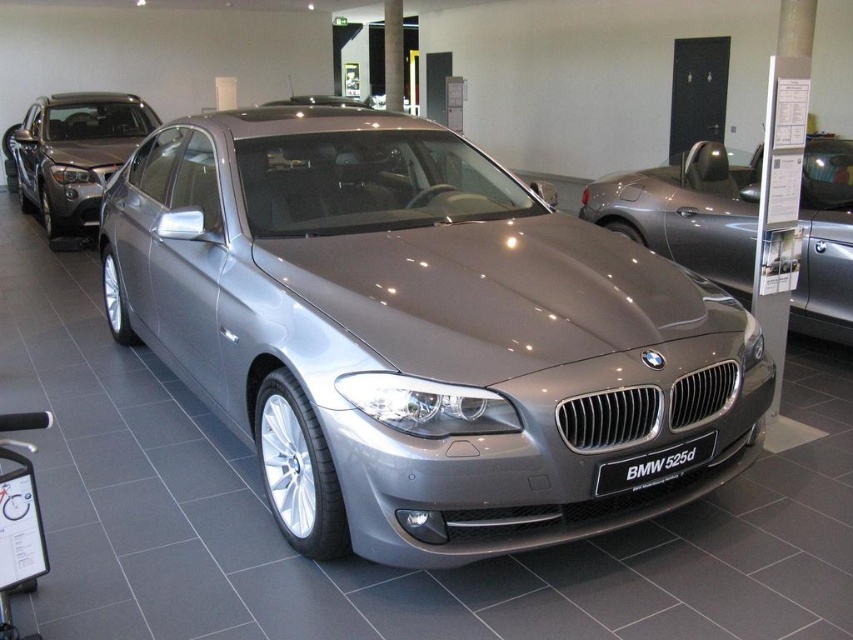
Does satin metallic car at center come behind satin silver metallic sedan at center?

No, it is in front of satin silver metallic sedan at center.

Which of these two, satin metallic car at center or satin silver metallic sedan at center, stands taller?

Standing taller between the two is satin metallic car at center.

Describe the element at coordinates (421, 336) in the screenshot. I see `satin metallic car at center` at that location.

This screenshot has height=640, width=853. What are the coordinates of `satin metallic car at center` in the screenshot? It's located at (421, 336).

Between point (581, 509) and point (830, 224), which one is positioned in front?

Point (581, 509) is more forward.

Which is above, satin metallic car at center or satin silver metallic car at center?

Positioned higher is satin silver metallic car at center.

Who is more distant from viewer, [643,381] or [838,145]?

Point [838,145]

Where is `satin metallic car at center`? The height and width of the screenshot is (640, 853). satin metallic car at center is located at coordinates (421, 336).

Is satin silver metallic car at center wider than satin silver metallic sedan at center?

In fact, satin silver metallic car at center might be narrower than satin silver metallic sedan at center.

Does point (755, 202) come in front of point (4, 156)?

That is True.

Is point (700, 221) closer to camera compared to point (28, 136)?

Yes, point (700, 221) is in front of point (28, 136).

In order to click on satin silver metallic car at center in this screenshot , I will do `click(688, 212)`.